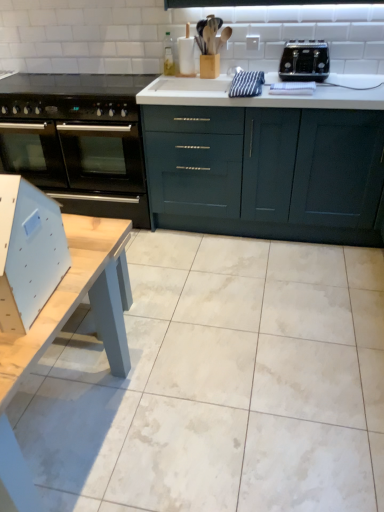
The image size is (384, 512). I want to click on vacant space behind light blue plastic chair at lower left, so click(86, 248).